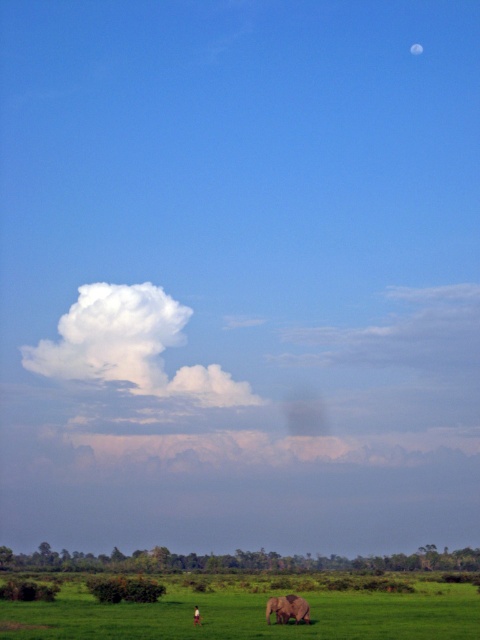
Question: Does white fluffy cloud at upper center have a greater width compared to gray matte elephant at lower center?

Choices:
 (A) yes
 (B) no

Answer: (A)

Question: Is white fluffy cloud at upper center thinner than gray matte elephant at lower center?

Choices:
 (A) yes
 (B) no

Answer: (B)

Question: Does white fluffy cloud at upper center have a lesser width compared to gray matte elephant at lower center?

Choices:
 (A) yes
 (B) no

Answer: (B)